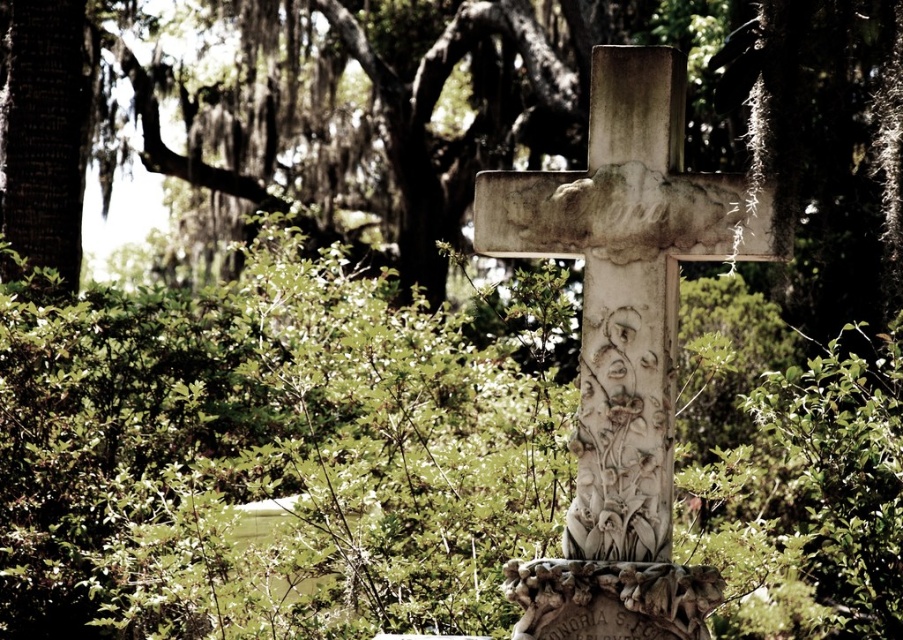
Question: Is white stone cross at center wider than carved stone gravestone at center?

Choices:
 (A) yes
 (B) no

Answer: (A)

Question: Among these points, which one is nearest to the camera?

Choices:
 (A) (510, 193)
 (B) (528, 588)

Answer: (B)

Question: Among these points, which one is farthest from the camera?

Choices:
 (A) (594, 509)
 (B) (589, 609)
 (C) (280, 285)

Answer: (C)

Question: In this image, where is green leafy bush at center located relative to carved stone gravestone at center?

Choices:
 (A) right
 (B) left

Answer: (B)

Question: Which object is farther from the camera taking this photo?

Choices:
 (A) carved stone gravestone at center
 (B) green leafy bush at center
 (C) white stone cross at center

Answer: (B)

Question: Can you confirm if green leafy bush at center is positioned to the left of white stone cross at center?

Choices:
 (A) yes
 (B) no

Answer: (A)